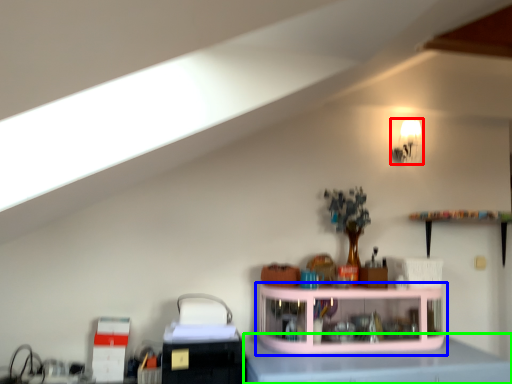
Question: Which is farther away from light fixture (highlighted by a red box)? shelf (highlighted by a blue box) or counter top (highlighted by a green box)?

Choices:
 (A) shelf
 (B) counter top

Answer: (B)